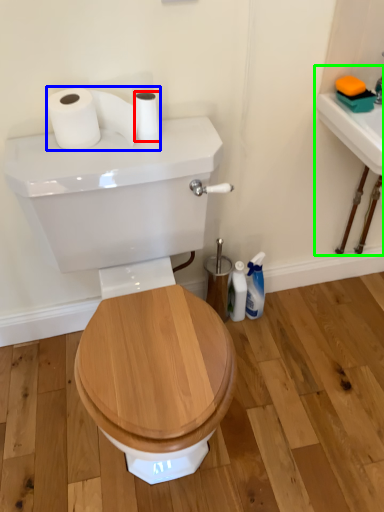
Question: Which is farther away from toilet paper (highlighted by a red box)? toilet paper (highlighted by a blue box) or sink (highlighted by a green box)?

Choices:
 (A) toilet paper
 (B) sink

Answer: (B)